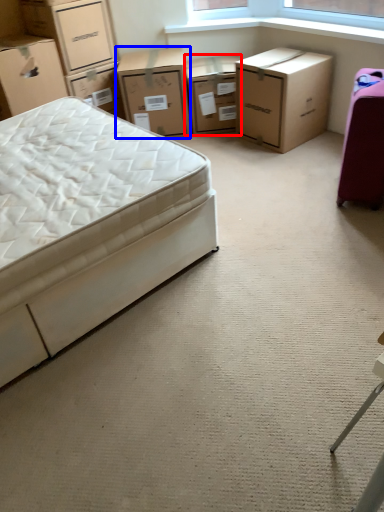
Question: Which object is further to the camera taking this photo, chest of drawers (highlighted by a red box) or chest of drawers (highlighted by a blue box)?

Choices:
 (A) chest of drawers
 (B) chest of drawers

Answer: (A)